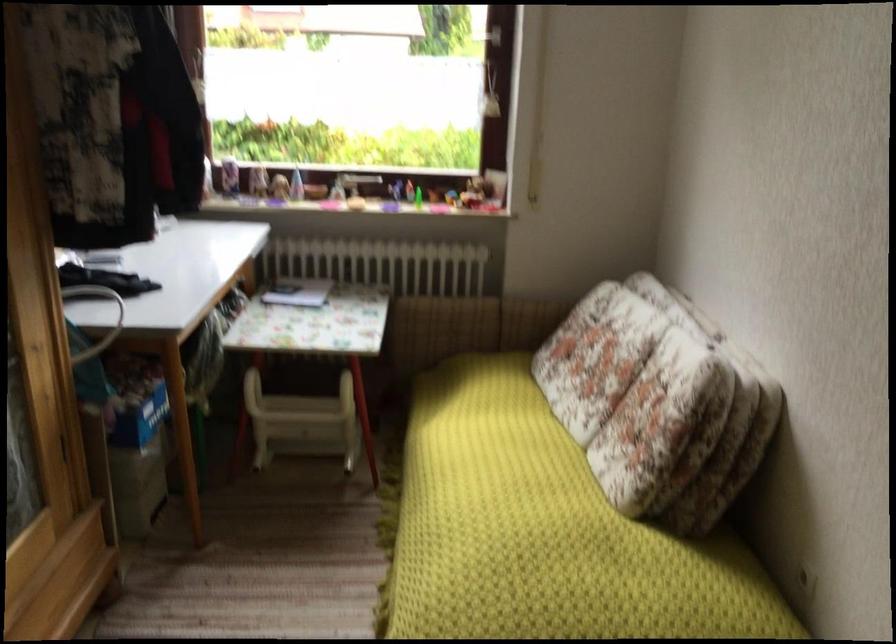
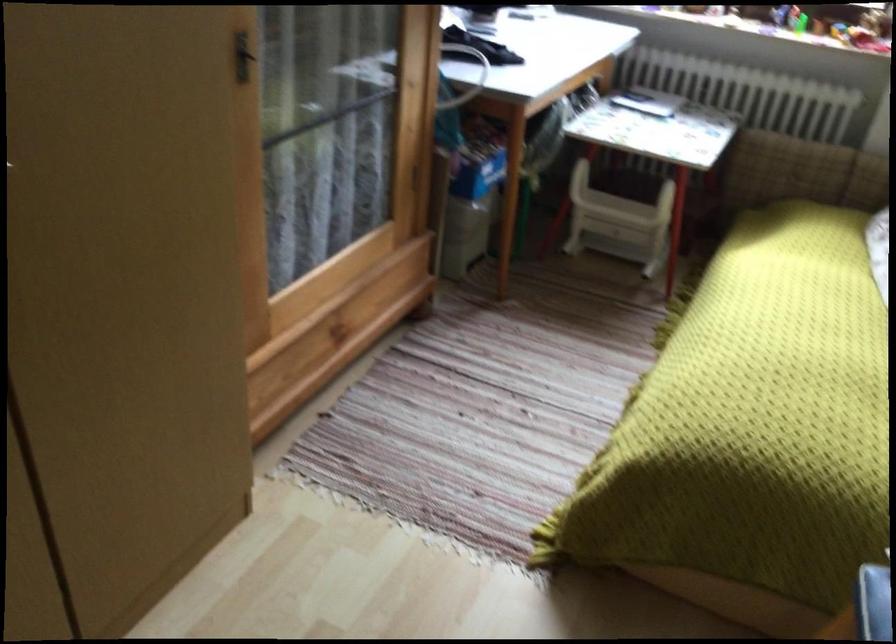
In a continuous first-person perspective shot, in which direction is the camera moving?

The cameraman walked toward right, backward.